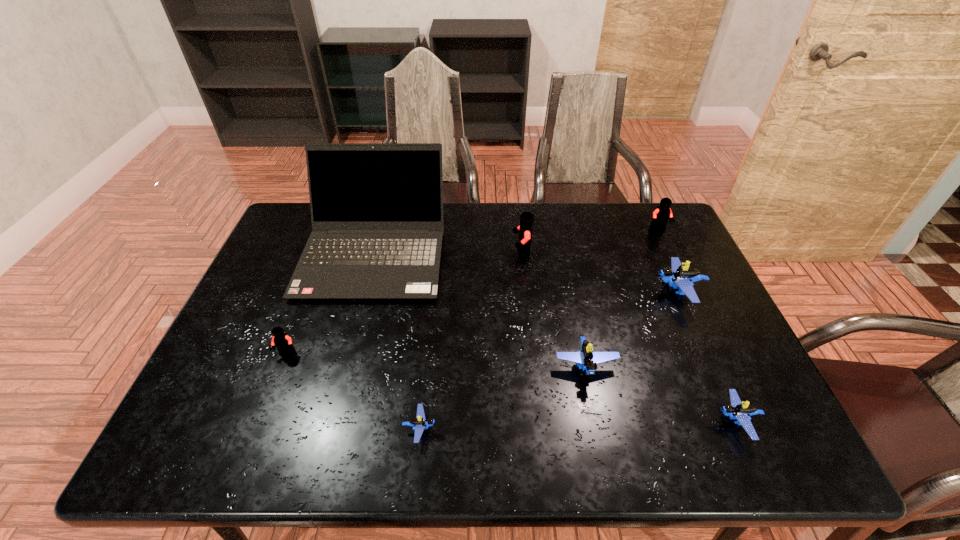
Locate an element on the screen. This screenshot has width=960, height=540. vacant area situated on the front-facing side of the rightmost black Lego is located at coordinates (683, 281).

This screenshot has width=960, height=540. In order to click on free location located on the front-facing side of the farthest blue Lego in this screenshot , I will do `click(569, 292)`.

The width and height of the screenshot is (960, 540). What are the coordinates of `vacant space located on the front-facing side of the farthest blue Lego` in the screenshot? It's located at (597, 292).

At what (x,y) coordinates should I click in order to perform the action: click on vacant region located 0.160m on the front-facing side of the farthest blue Lego. Please return your answer as a coordinate pair (x, y). The image size is (960, 540). Looking at the image, I should click on pyautogui.click(x=597, y=292).

Identify the location of free space located on the front-facing side of the third smallest blue Lego. This screenshot has height=540, width=960. tap(601, 441).

I want to click on vacant space situated 0.150m on the front-facing side of the nearest black Lego, so click(264, 414).

Image resolution: width=960 pixels, height=540 pixels. Identify the location of vacant space located 0.190m on the front-facing side of the second shortest object. (629, 421).

Identify the location of vacant space situated on the front-facing side of the second shortest object. The height and width of the screenshot is (540, 960). (602, 421).

This screenshot has height=540, width=960. I want to click on vacant area situated 0.270m on the front-facing side of the second shortest object, so click(x=592, y=421).

At what (x,y) coordinates should I click in order to perform the action: click on free space located on the front-facing side of the second Lego from left to right. Please return your answer as a coordinate pair (x, y). Image resolution: width=960 pixels, height=540 pixels. Looking at the image, I should click on (473, 428).